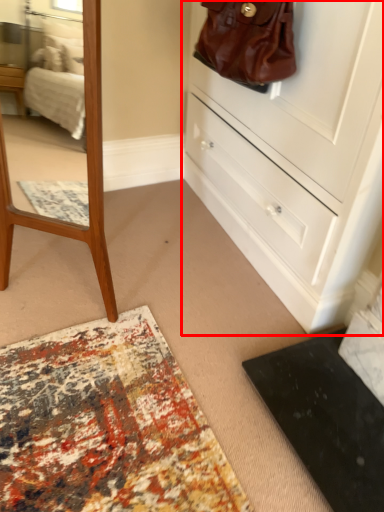
Question: From the image, what is the correct spatial relationship of chest of drawers (annotated by the red box) in relation to handbag?

Choices:
 (A) left
 (B) right

Answer: (B)